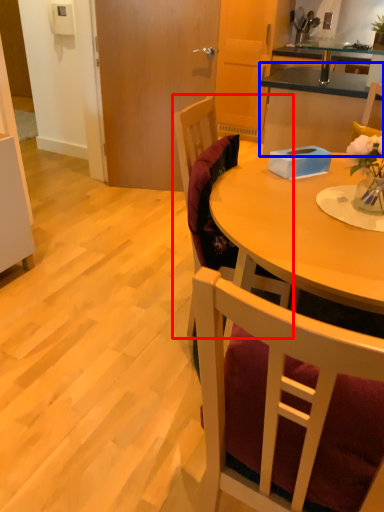
Question: Which object appears closest to the camera in this image, chair (highlighted by a red box) or cabinetry (highlighted by a blue box)?

Choices:
 (A) chair
 (B) cabinetry

Answer: (A)